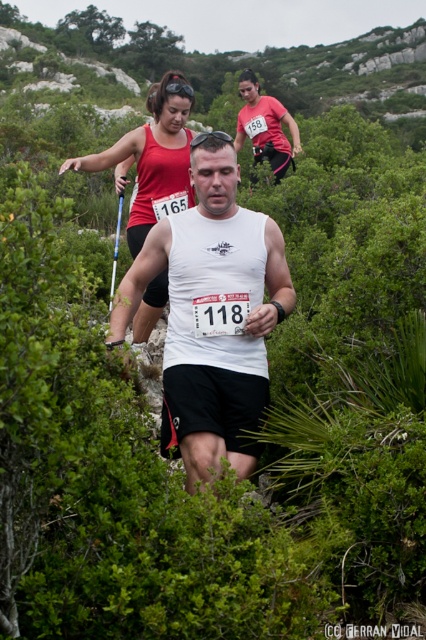
Question: Does white matte tank top at center have a larger size compared to matte white tank top at center?

Choices:
 (A) yes
 (B) no

Answer: (B)

Question: Is matte red tank top at center further to camera compared to matte white tank top at center?

Choices:
 (A) no
 (B) yes

Answer: (A)

Question: Which of the following is the closest to the observer?

Choices:
 (A) (189, 468)
 (B) (187, 186)

Answer: (A)

Question: Which of these objects is positioned closest to the white matte tank top at center?

Choices:
 (A) matte red tank top at center
 (B) matte white tank top at center

Answer: (A)

Question: Which point is closer to the camera?

Choices:
 (A) matte red tank top at center
 (B) white matte tank top at center
 (C) matte white tank top at center

Answer: (B)

Question: Does white matte tank top at center appear over matte white tank top at center?

Choices:
 (A) yes
 (B) no

Answer: (B)